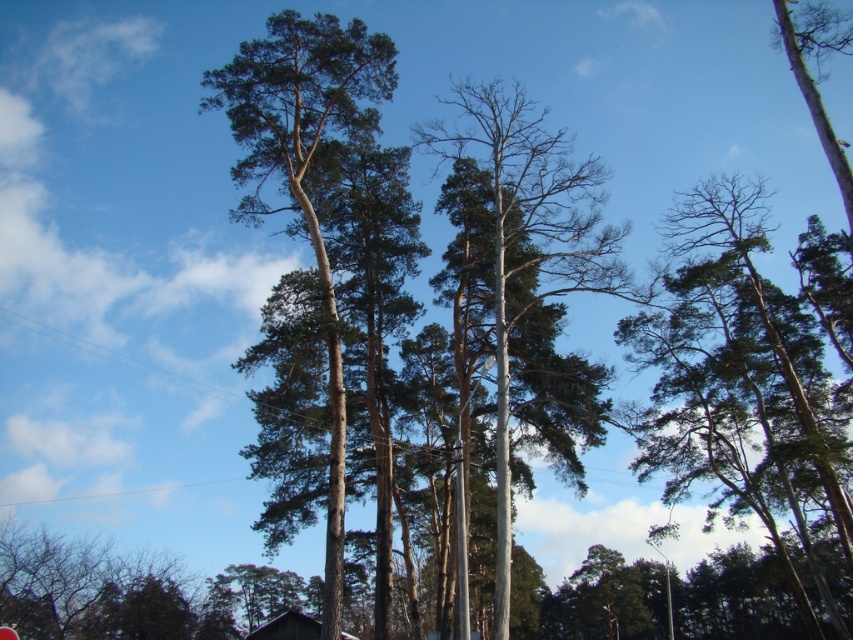
You are standing in a forest looking up at the trees. You notice a green matte tree at upper right and a smooth gray tree at center. Which tree is closer to the sky?

The smooth gray tree at center is closer to the sky because the green matte tree at upper right is positioned under it.

You are standing in a forest and looking up at the trees. You notice the green matte tree at upper right and the smooth gray tree at center. Which tree is closer to you?

The green matte tree at upper right is closer to you because the smooth gray tree at center is behind it.